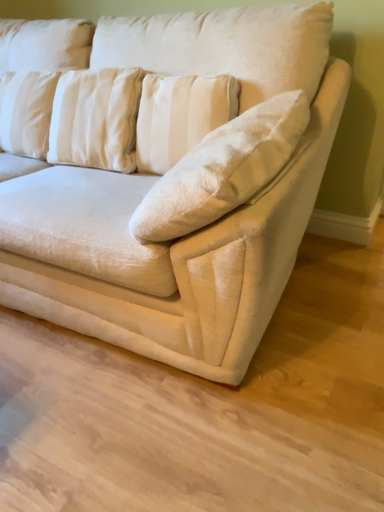
You are a GUI agent. You are given a task and a screenshot of the screen. Output one action in this format:
    pyautogui.click(x=<x>, y=<y>)
    Task: Click on the velvet beige couch at center
    The width and height of the screenshot is (384, 512).
    Given the screenshot: What is the action you would take?
    pyautogui.click(x=199, y=269)

Describe the element at coordinates (199, 269) in the screenshot. I see `velvet beige couch at center` at that location.

The height and width of the screenshot is (512, 384). I want to click on velvet beige couch at center, so (199, 269).